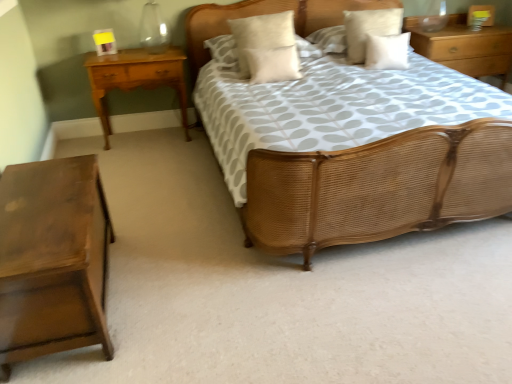
This screenshot has height=384, width=512. In order to click on vacant area that lies between dark brown wood nightstand at lower left, which ranks as the 2th nightstand in right-to-left order, and woven wood bed at center in this screenshot , I will do [x=199, y=242].